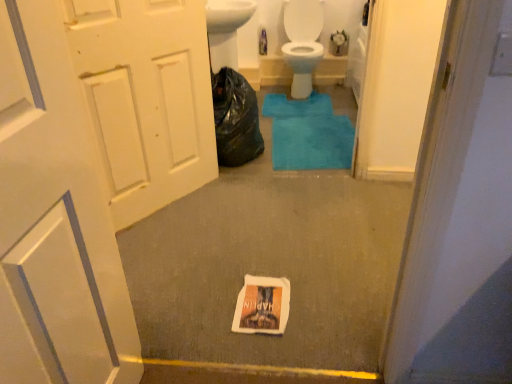
Find the location of a particular element. Image resolution: width=512 pixels, height=384 pixels. free spot below white paper flyer at center (from a real-world perspective) is located at coordinates (263, 301).